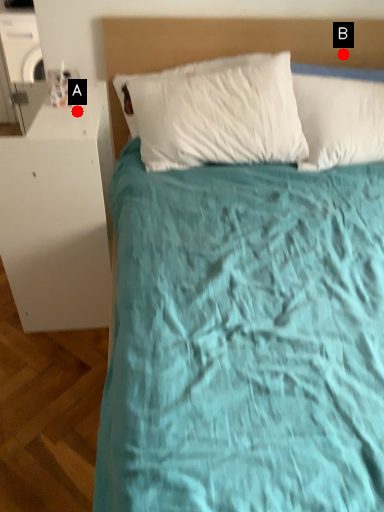
Question: Two points are circled on the image, labeled by A and B beside each circle. Which point is closer to the camera taking this photo?

Choices:
 (A) A is closer
 (B) B is closer

Answer: (A)